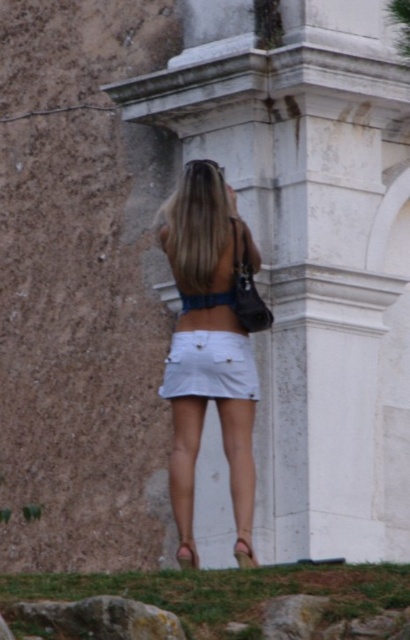
You are a photographer trying to capture a photo of the woman in the scene. The camera you are using has a maximum focus range of 30 feet. Can you focus on the white marble pillar at center and white cotton skirt at center simultaneously?

The white marble pillar at center and white cotton skirt at center are 32.51 feet apart. Since the distance between them exceeds the camera maximum focus range of 30 feet, you cannot focus on both simultaneously.

You are a fashion designer observing the scene. You need to determine if the white denim skirt at center can be paired with the gray rough rock at lower left in a photoshoot. Considering their sizes, would the skirt appear proportionally balanced with the rock?

The white denim skirt at center has a larger size compared to the gray rough rock at lower left. Therefore, the skirt would dominate the composition, potentially creating an imbalance unless the rock is placed strategically to complement its scale.